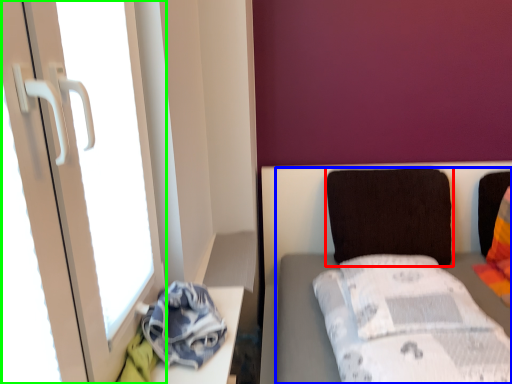
Question: Which is farther away from pillow (highlighted by a red box)? furniture (highlighted by a blue box) or screen door (highlighted by a green box)?

Choices:
 (A) furniture
 (B) screen door

Answer: (B)